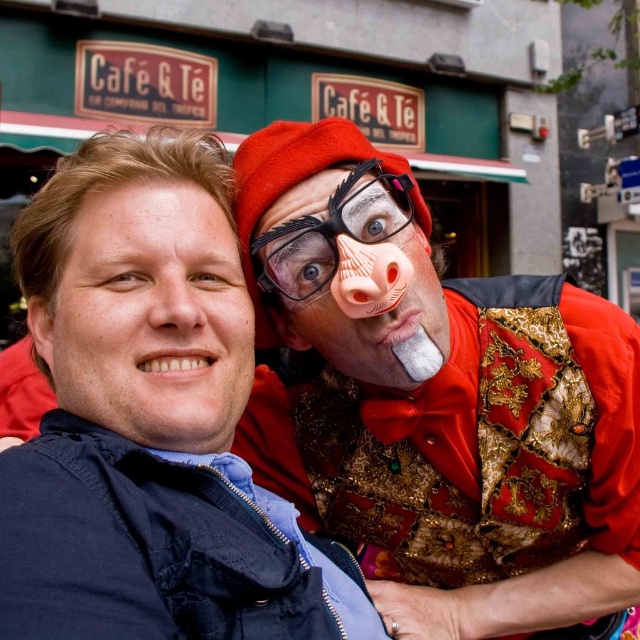
Does matte gold vest at right appear on the right side of matte plastic clown nose at right?

Indeed, matte gold vest at right is positioned on the right side of matte plastic clown nose at right.

From the picture: Can you confirm if matte gold vest at right is bigger than matte plastic clown nose at right?

Indeed, matte gold vest at right has a larger size compared to matte plastic clown nose at right.

Find the location of a particular element. The image size is (640, 640). matte gold vest at right is located at coordinates (435, 401).

Is point (406, 433) more distant than point (77, 298)?

Yes, it is behind point (77, 298).

Describe the element at coordinates (435, 401) in the screenshot. The width and height of the screenshot is (640, 640). I see `matte gold vest at right` at that location.

The height and width of the screenshot is (640, 640). In order to click on matte gold vest at right in this screenshot , I will do `click(435, 401)`.

In the scene shown: Who is shorter, matte skin face at left or matte plastic clown nose at right?

With less height is matte plastic clown nose at right.

Does matte skin face at left come behind matte plastic clown nose at right?

No, it is not.

The image size is (640, 640). What do you see at coordinates (150, 317) in the screenshot?
I see `matte skin face at left` at bounding box center [150, 317].

Where is `matte skin face at left`? This screenshot has height=640, width=640. matte skin face at left is located at coordinates (150, 317).